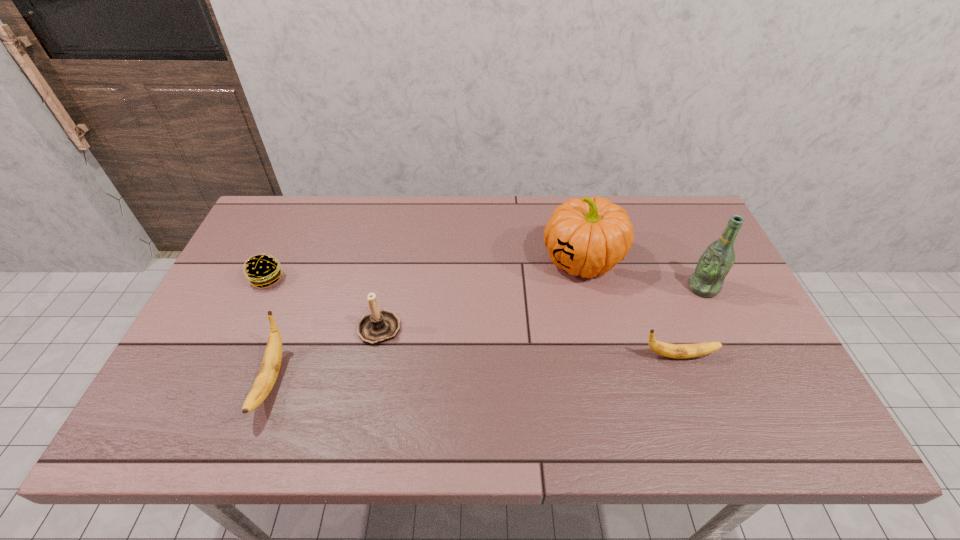
Image resolution: width=960 pixels, height=540 pixels. I want to click on the taller banana, so click(266, 378).

This screenshot has width=960, height=540. In order to click on the left banana in this screenshot , I will do `click(266, 378)`.

This screenshot has width=960, height=540. Identify the location of the right banana. (680, 351).

This screenshot has width=960, height=540. I want to click on the second shortest object, so click(680, 351).

Image resolution: width=960 pixels, height=540 pixels. What are the coordinates of `pumpkin` in the screenshot? It's located at (588, 236).

This screenshot has height=540, width=960. I want to click on the rightmost object, so click(714, 264).

Locate an element on the screen. candle holder is located at coordinates (379, 326).

Where is `patty`? The width and height of the screenshot is (960, 540). patty is located at coordinates (262, 270).

Where is `the shortest object`? This screenshot has height=540, width=960. the shortest object is located at coordinates (262, 270).

Where is `free space located on the peel of the second shortest object from the top`? The image size is (960, 540). free space located on the peel of the second shortest object from the top is located at coordinates (744, 356).